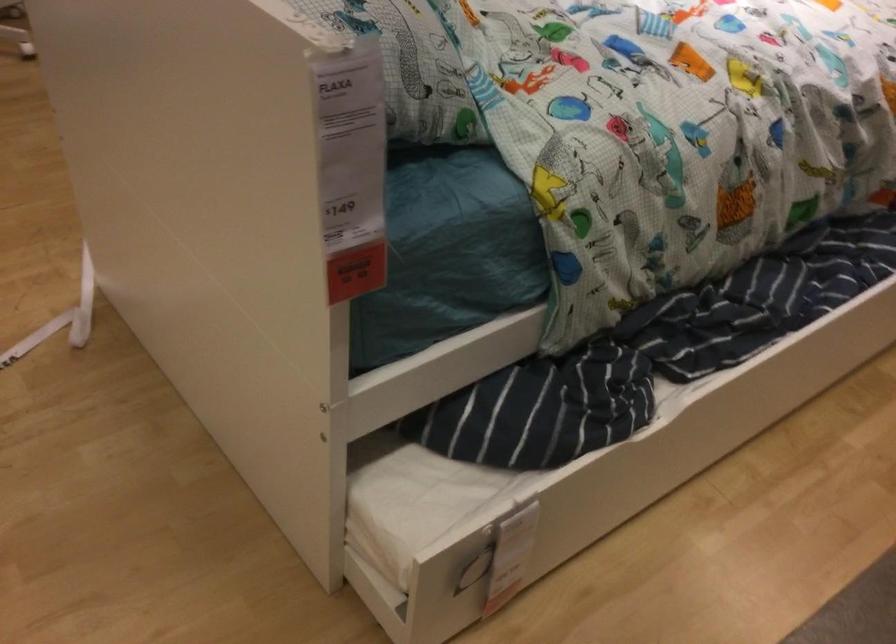
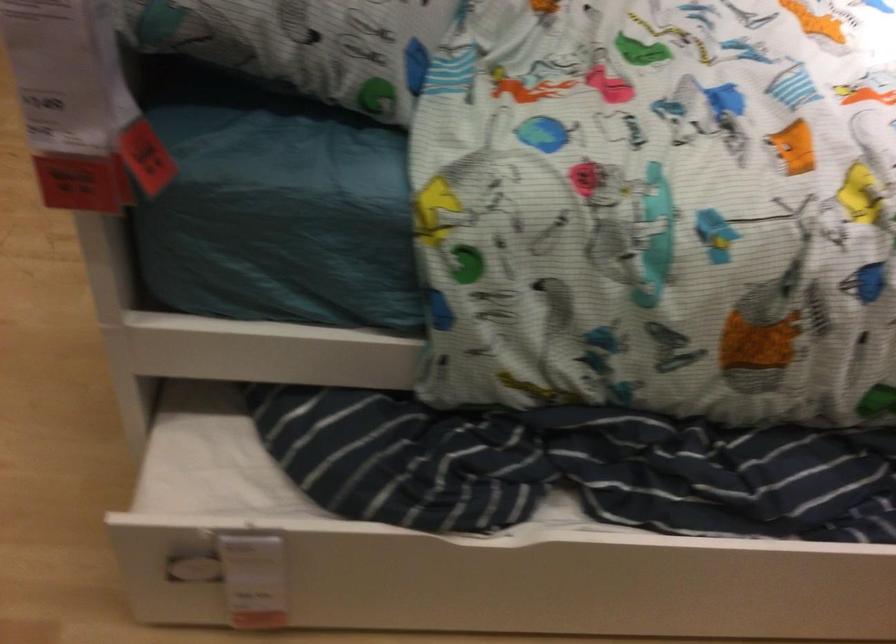
Where in the second image is the point corresponding to (512,562) from the first image?

(240, 574)